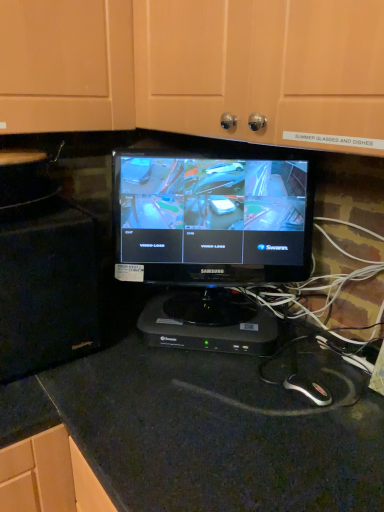
Where is `free space above black plastic device at center (from a real-world perspective)`? free space above black plastic device at center (from a real-world perspective) is located at coordinates (206, 311).